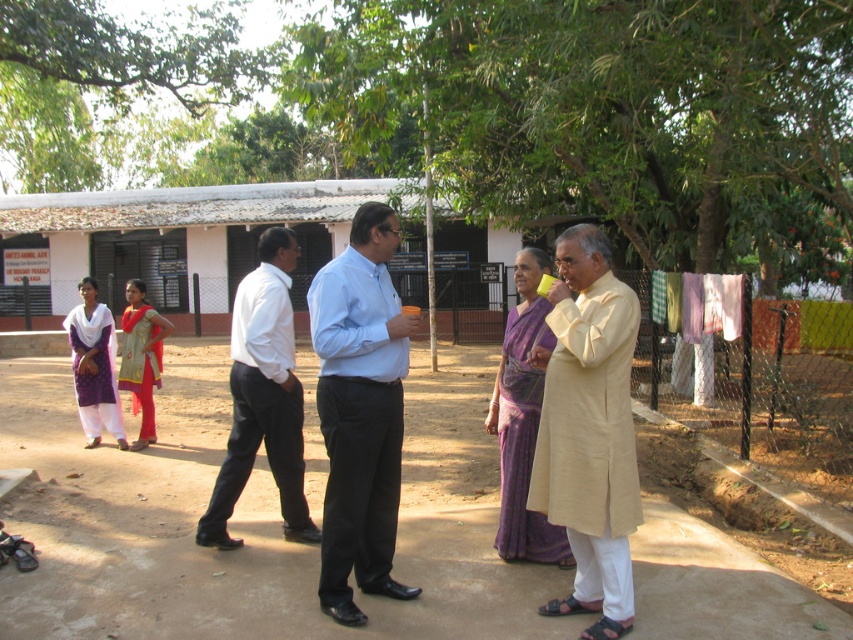
Is beige cotton kurta at center thinner than light blue shirt at center?

Yes, beige cotton kurta at center is thinner than light blue shirt at center.

Find the location of a particular element. beige cotton kurta at center is located at coordinates (589, 429).

Does point (567, 321) lie in front of point (352, 316)?

Yes.

At what (x,y) coordinates should I click in order to perform the action: click on beige cotton kurta at center. Please return your answer as a coordinate pair (x, y). The image size is (853, 640). Looking at the image, I should click on (589, 429).

Who is higher up, green leafy tree at upper center or light blue shirt at center?

green leafy tree at upper center is higher up.

Is point (41, 164) positioned in front of point (332, 310)?

No, it is behind (332, 310).

What do you see at coordinates (109, 84) in the screenshot? The height and width of the screenshot is (640, 853). I see `green leafy tree at upper center` at bounding box center [109, 84].

Where is `green leafy tree at upper center`? Image resolution: width=853 pixels, height=640 pixels. green leafy tree at upper center is located at coordinates (109, 84).

Is green leafy tree at upper center to the left of beige cotton kurta at center from the viewer's perspective?

Yes, green leafy tree at upper center is to the left of beige cotton kurta at center.

How much distance is there between green leafy tree at upper center and beige cotton kurta at center?

21.02 meters

Describe the element at coordinates (109, 84) in the screenshot. The image size is (853, 640). I see `green leafy tree at upper center` at that location.

Where is `green leafy tree at upper center`? This screenshot has height=640, width=853. green leafy tree at upper center is located at coordinates (109, 84).